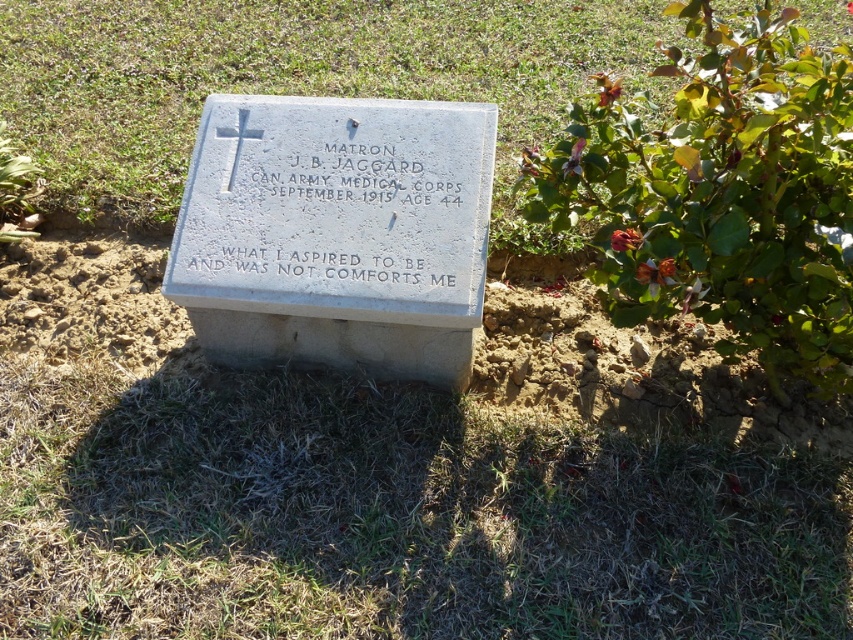
Question: Which of the following is the closest to the observer?

Choices:
 (A) (642, 280)
 (B) (567, 156)
 (C) (235, 154)

Answer: (A)

Question: Is orange matte flower at right further to camera compared to orange petal at upper right?

Choices:
 (A) no
 (B) yes

Answer: (A)

Question: Among these points, which one is nearest to the camera?

Choices:
 (A) (395, 45)
 (B) (618, 237)
 (C) (164, 296)

Answer: (B)

Question: Can you confirm if white stone cross at upper center is bigger than bright red petals at upper right?

Choices:
 (A) no
 (B) yes

Answer: (B)

Question: From the image, what is the correct spatial relationship of bright red petals at upper right in relation to red matte flower at upper right?

Choices:
 (A) above
 (B) below

Answer: (B)

Question: Considering the real-world distances, which object is closest to the bright red petals at upper right?

Choices:
 (A) gray stone gravestone at center
 (B) green grass at center
 (C) red matte flower at upper right
 (D) orange petal at upper right

Answer: (C)